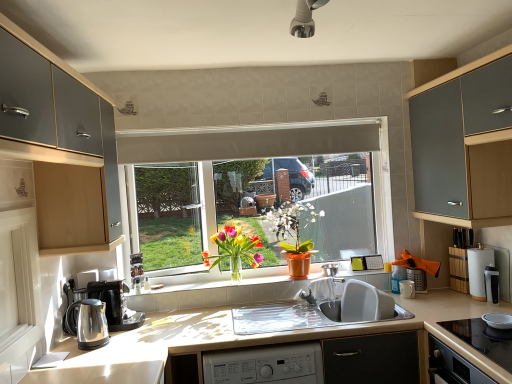
What are the coordinates of `vacant area that is situated to the right of shiny black coffee machine at left` in the screenshot? It's located at (167, 323).